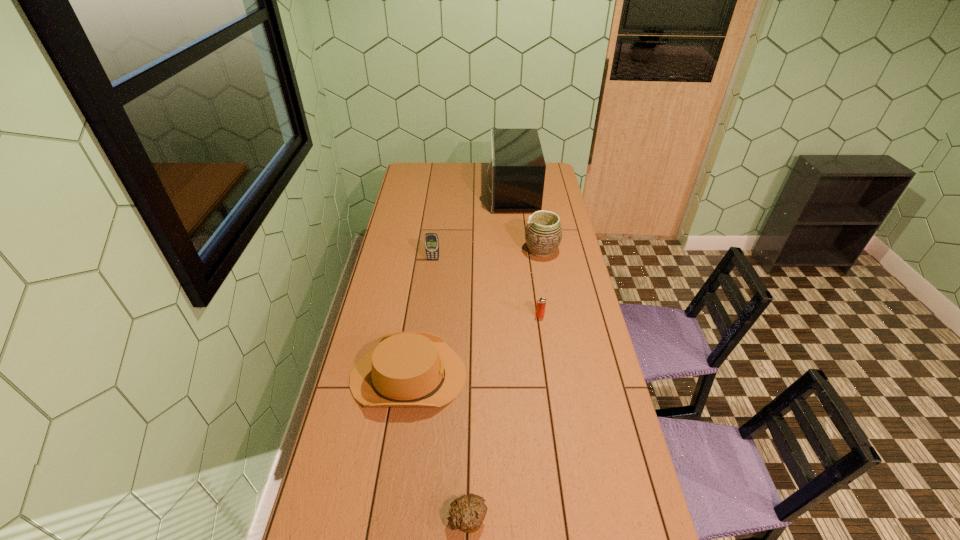
You are a GUI agent. You are given a task and a screenshot of the screen. Output one action in this format:
    pyautogui.click(x=<x>, y=<y>)
    Task: Click on the tallest object
    
    Given the screenshot: What is the action you would take?
    (517, 167)

Where is `microwave oven`? The image size is (960, 540). microwave oven is located at coordinates (517, 167).

Where is `pottery`? The image size is (960, 540). pottery is located at coordinates (543, 234).

Locate an element on the screen. The width and height of the screenshot is (960, 540). cellular telephone is located at coordinates (431, 239).

Identify the location of the fourth tallest object. Image resolution: width=960 pixels, height=540 pixels. (405, 369).

You are a GUI agent. You are given a task and a screenshot of the screen. Output one action in this format:
    pyautogui.click(x=<x>, y=<y>)
    Task: Click on the second nearest object
    
    Given the screenshot: What is the action you would take?
    pyautogui.click(x=405, y=369)

I want to click on the fourth farthest object, so (541, 303).

Where is `the fifth tallest object`? The image size is (960, 540). the fifth tallest object is located at coordinates (541, 303).

Find the location of `the shortest object`. the shortest object is located at coordinates (468, 512).

Locate an element on the screen. The width and height of the screenshot is (960, 540). muffin is located at coordinates (468, 512).